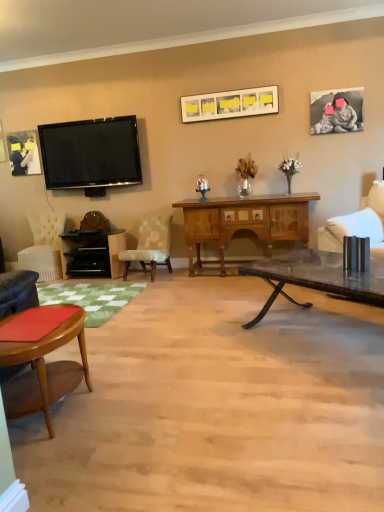
Identify the location of empty space that is ontop of transparent glass coffee table at center (from a real-world perspective). (331, 270).